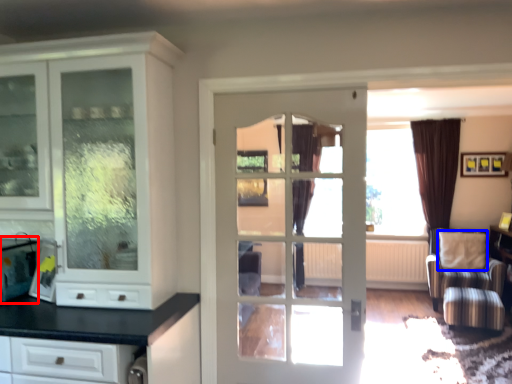
Question: Which object is closer to the camera taking this photo, appliance (highlighted by a red box) or pillow (highlighted by a blue box)?

Choices:
 (A) appliance
 (B) pillow

Answer: (A)